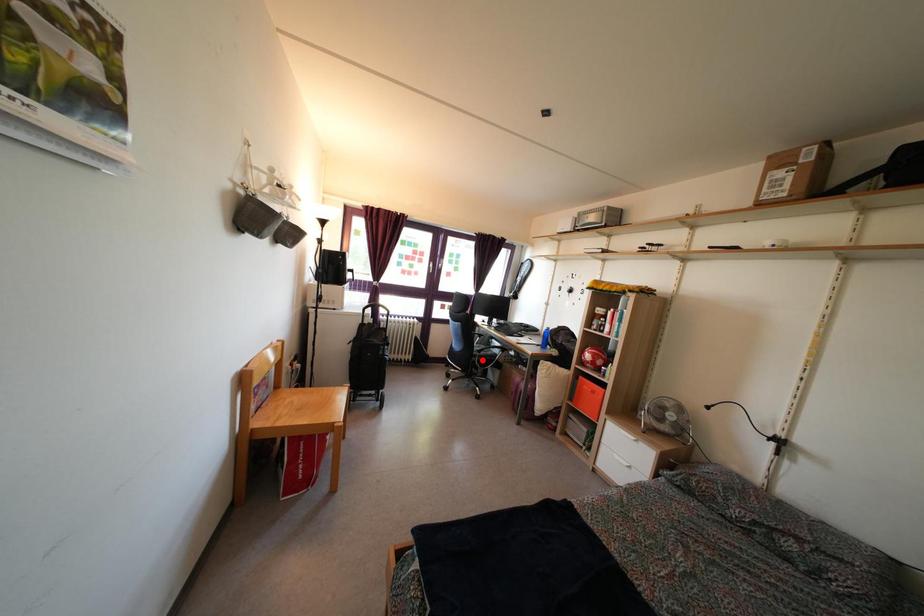
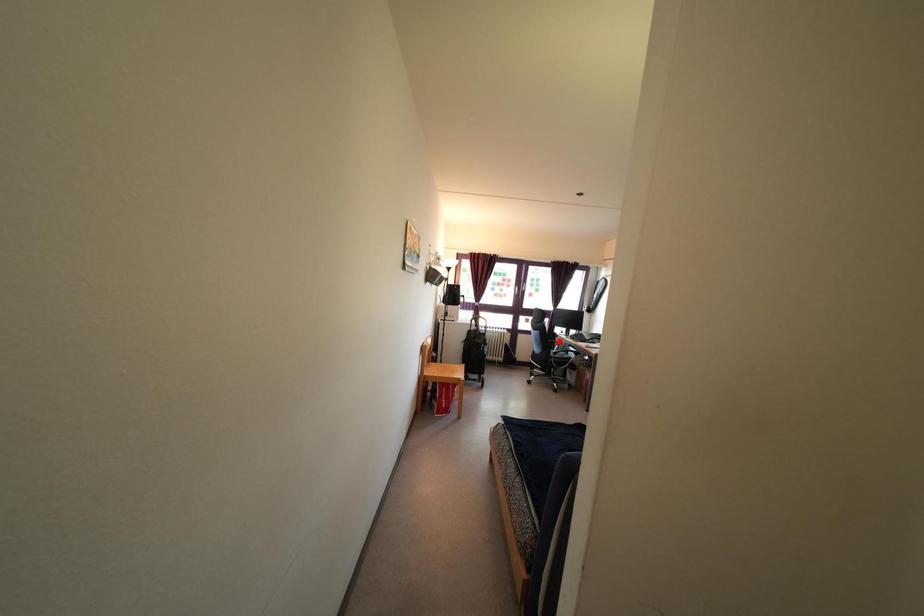
I am providing you with two images of the same scene from different viewpoints. A red point is marked on the first image and another point is marked on the second image. Is the red point in image1 aligned with the point shown in image2?

No